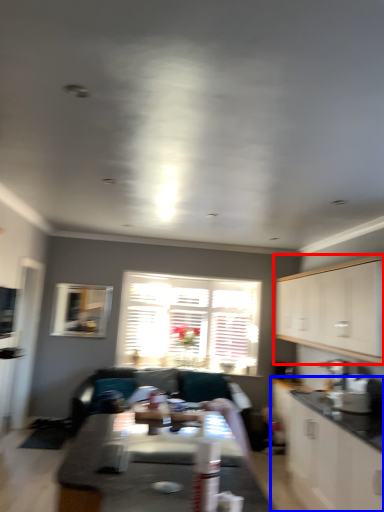
Question: Which of the following is the farthest to the observer, cabinetry (highlighted by a red box) or cabinetry (highlighted by a blue box)?

Choices:
 (A) cabinetry
 (B) cabinetry

Answer: (A)